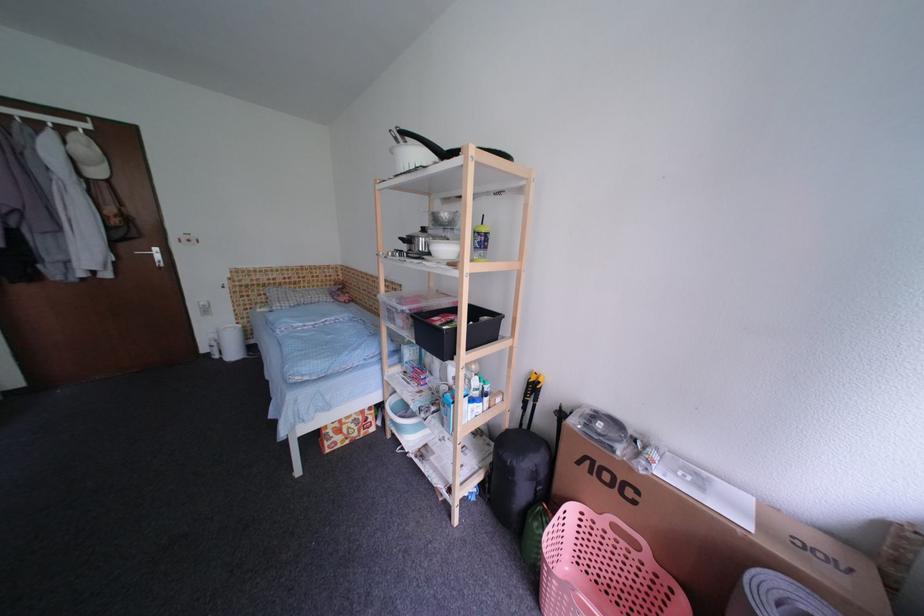
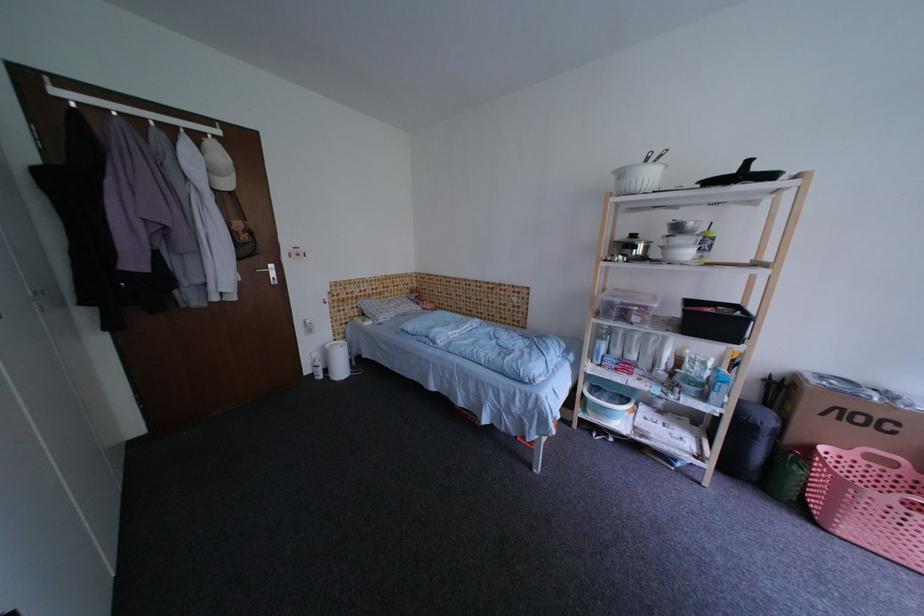
Where in the second image is the point corresponding to point (223, 346) from the first image?

(326, 366)